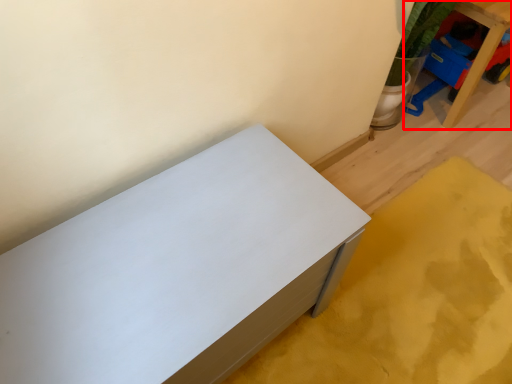
Question: Observing the image, what is the correct spatial positioning of furniture (annotated by the red box) in reference to furniture?

Choices:
 (A) right
 (B) left

Answer: (A)